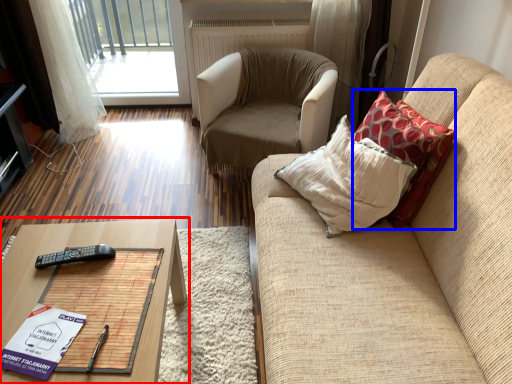
Question: Which object is further to the camera taking this photo, table (highlighted by a red box) or throw pillow (highlighted by a blue box)?

Choices:
 (A) table
 (B) throw pillow

Answer: (B)